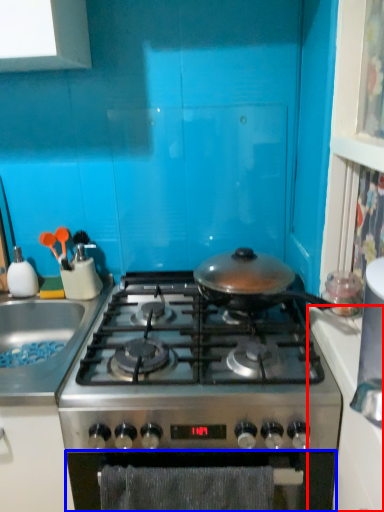
Question: Which of the following is the closest to the observer, counter top (highlighted by a red box) or oven (highlighted by a blue box)?

Choices:
 (A) counter top
 (B) oven

Answer: (A)